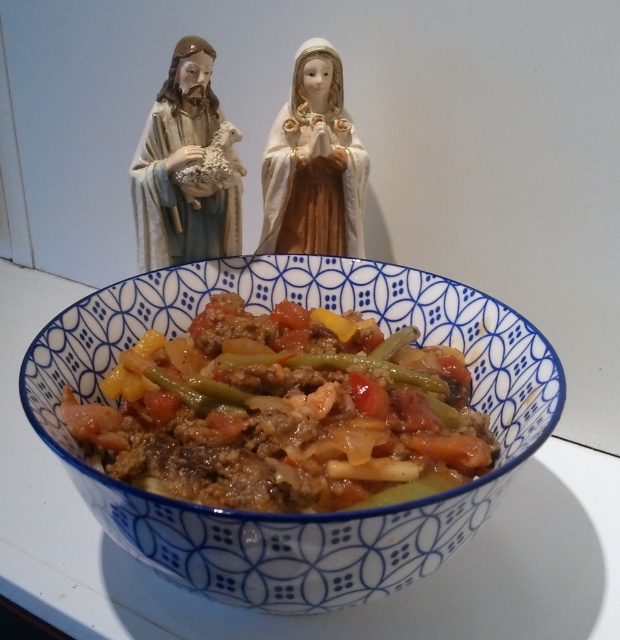
Looking at this image, what is the exact coordinate of the blue ceramic bowl at center?

The blue ceramic bowl at center is located at point (x=296, y=515).

You are an interior designer arranging items on a shelf. You have the matte porcelain figurine at upper left and the porcelain doll at upper center. If you want to place them so that one is visible without blocking the other, which one should be placed in front?

The matte porcelain figurine at upper left should be placed in front of the porcelain doll at upper center to ensure both are visible without blocking each other.

You are a chef who wants to place a new plate on the counter next to the blue ceramic bowl at center and the matte porcelain figurine at upper left. Which object should you move to make space?

The blue ceramic bowl at center is much taller than the matte porcelain figurine at upper left, so you should move the shorter matte porcelain figurine at upper left to make space for the new plate.